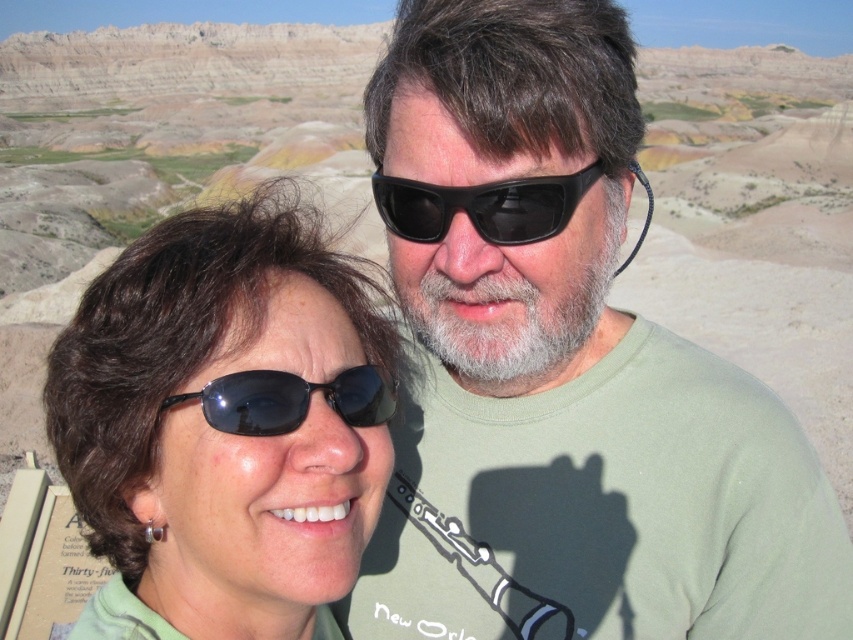
You are a photographer trying to capture a clear shot of both the matte black sunglasses at left and the black matte sunglasses at center. However, the sunglasses at left are partially blocking the view of the ones at center. Can you adjust your position to see both fully without any obstruction?

The matte black sunglasses at left is in front of the black matte sunglasses at center, so moving your position slightly to the side might allow you to see both fully without obstruction.